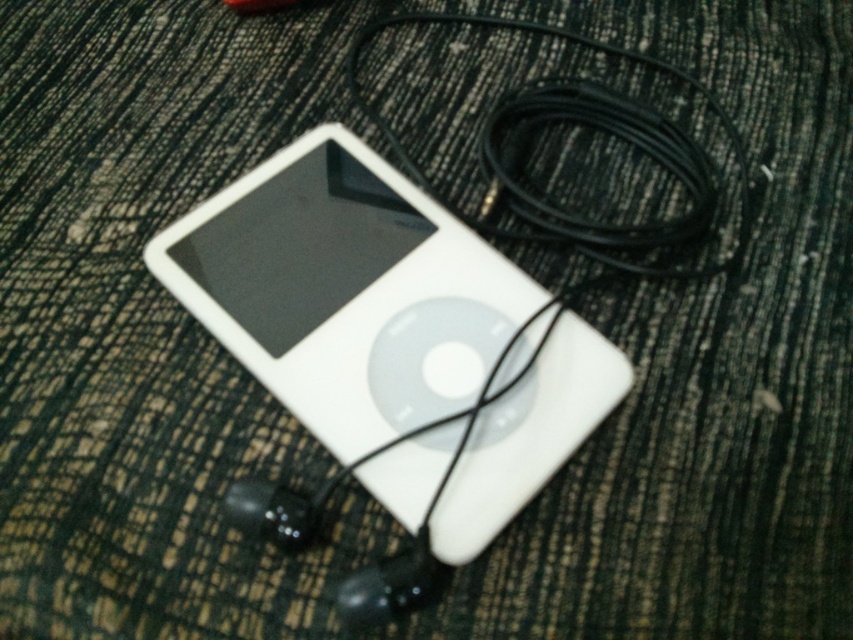
Between white matte ipod at center and black cable at upper right, which one appears on the left side from the viewer's perspective?

From the viewer's perspective, white matte ipod at center appears more on the left side.

Who is higher up, white matte ipod at center or black cable at upper right?

Positioned higher is black cable at upper right.

Does point (184, 220) lie behind point (566, 38)?

No, (184, 220) is in front of (566, 38).

Where is `white matte ipod at center`? This screenshot has height=640, width=853. white matte ipod at center is located at coordinates (345, 291).